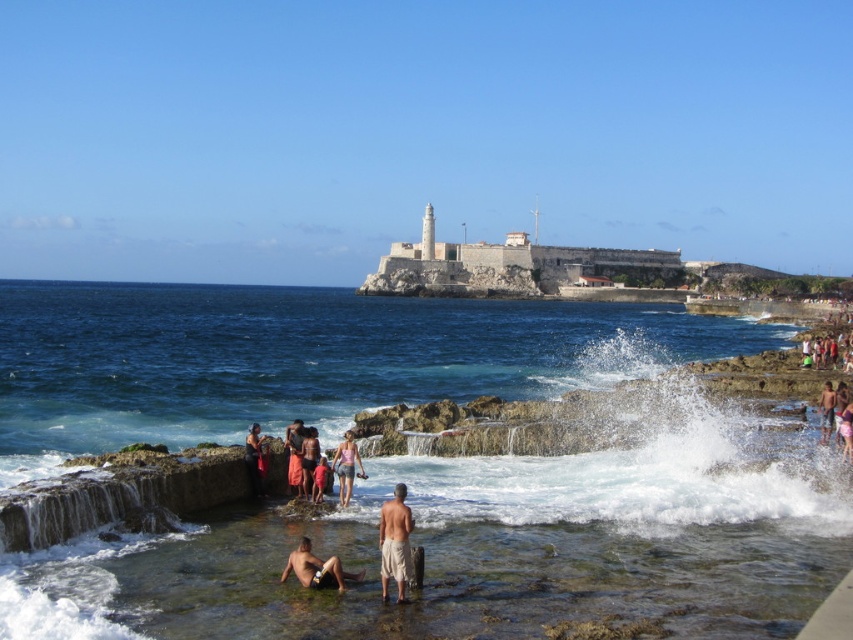
Does light brown skin at lower right have a lesser width compared to matte pink shorts at center?

Incorrect, light brown skin at lower right's width is not less than matte pink shorts at center's.

Does light brown skin at lower right have a larger size compared to matte pink shorts at center?

Indeed, light brown skin at lower right has a larger size compared to matte pink shorts at center.

Locate an element on the screen. Image resolution: width=853 pixels, height=640 pixels. light brown skin at lower right is located at coordinates (827, 410).

Who is lower down, pink fabric shorts at lower right or matte pink shorts at center?

matte pink shorts at center is below.

Is point (839, 416) farther from viewer compared to point (329, 472)?

Yes, point (839, 416) is farther from viewer.

Locate an element on the screen. pink fabric shorts at lower right is located at coordinates (846, 429).

Does clear blue water at center appear on the left side of matte pink shorts at center?

Correct, you'll find clear blue water at center to the left of matte pink shorts at center.

The width and height of the screenshot is (853, 640). Describe the element at coordinates (497, 545) in the screenshot. I see `clear blue water at center` at that location.

You are a GUI agent. You are given a task and a screenshot of the screen. Output one action in this format:
    pyautogui.click(x=<x>, y=<y>)
    Task: Click on the clear blue water at center
    The image size is (853, 640).
    Given the screenshot: What is the action you would take?
    pyautogui.click(x=497, y=545)